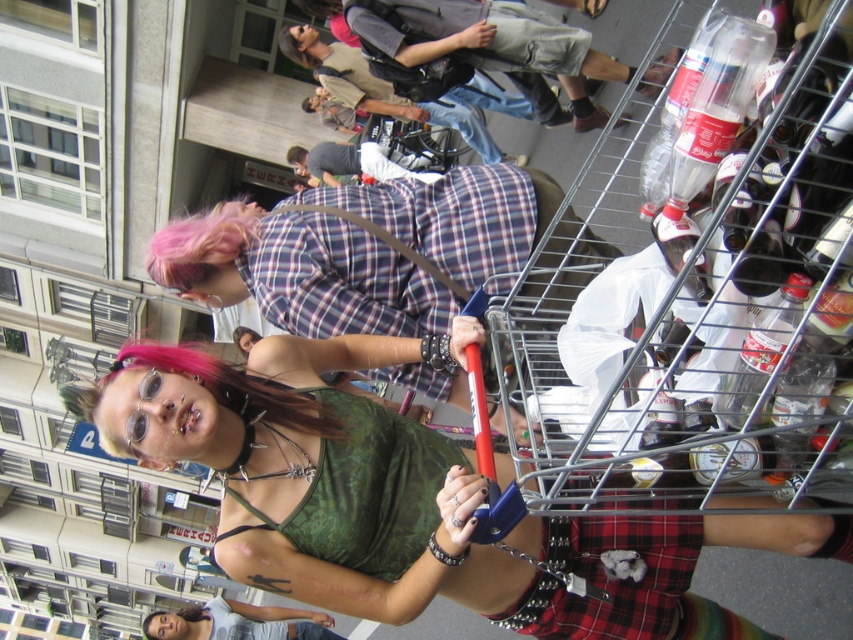
You are a photographer standing at the center of the street. You want to take a photo that includes both the point at position (279, 388) and the point at position (384, 179). Which point should you focus on first to ensure both are in focus?

You should focus on point (279, 388) first because it is closer to the camera and will ensure the point at (384, 179) is also in focus due to depth of field.